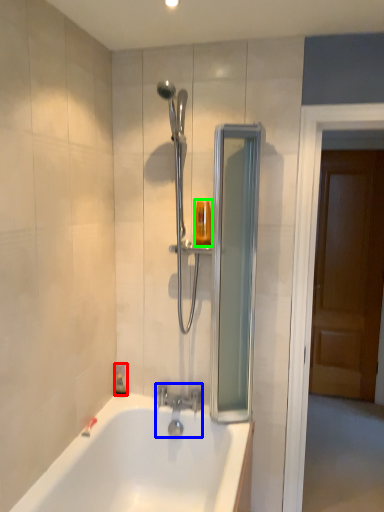
Question: Estimate the real-world distances between objects in this image. Which object is closer to soap dispenser (highlighted by a red box), tap (highlighted by a blue box) or toiletry (highlighted by a green box)?

Choices:
 (A) tap
 (B) toiletry

Answer: (A)